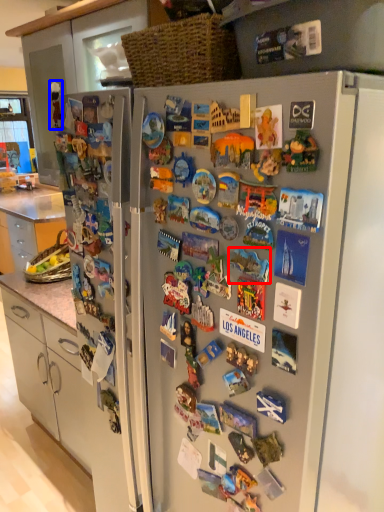
Question: Which object appears closest to the camera in this image, toy (highlighted by a red box) or toy (highlighted by a blue box)?

Choices:
 (A) toy
 (B) toy

Answer: (A)